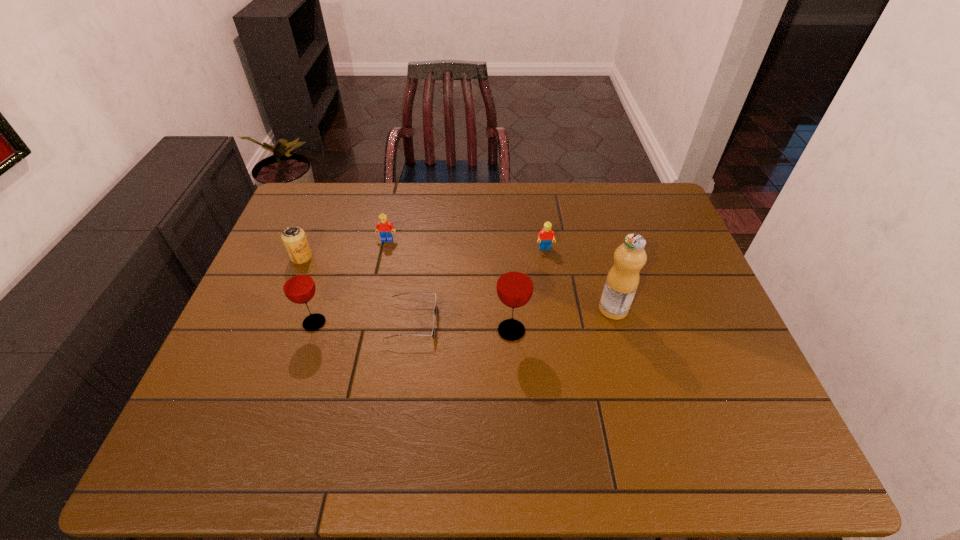
Where is `the fourth object from left to right`? the fourth object from left to right is located at coordinates (435, 309).

Identify the location of the shortest object. (435, 309).

At what (x,y) coordinates should I click in order to perform the action: click on vacant space positioned on the front of the fifth shortest object. Please return your answer as a coordinate pair (x, y). Image resolution: width=960 pixels, height=540 pixels. Looking at the image, I should click on (301, 361).

Where is `free spot located on the right of the right glass`? The height and width of the screenshot is (540, 960). free spot located on the right of the right glass is located at coordinates (649, 331).

This screenshot has width=960, height=540. Identify the location of free spot located on the face of the left Lego. (375, 292).

At what (x,y) coordinates should I click in order to perform the action: click on vacant region located 0.050m on the face of the nearer Lego. Please return your answer as a coordinate pair (x, y). Looking at the image, I should click on (547, 264).

Locate an element on the screen. The height and width of the screenshot is (540, 960). free space located 0.280m on the front of the beer can is located at coordinates (267, 342).

I want to click on free region located on the front label of the fruit juice, so click(573, 309).

The width and height of the screenshot is (960, 540). I want to click on blank space located 0.230m on the front label of the fruit juice, so click(x=513, y=309).

The image size is (960, 540). Find the location of `vacant space situated 0.170m on the front label of the fruit juice`. vacant space situated 0.170m on the front label of the fruit juice is located at coordinates (536, 309).